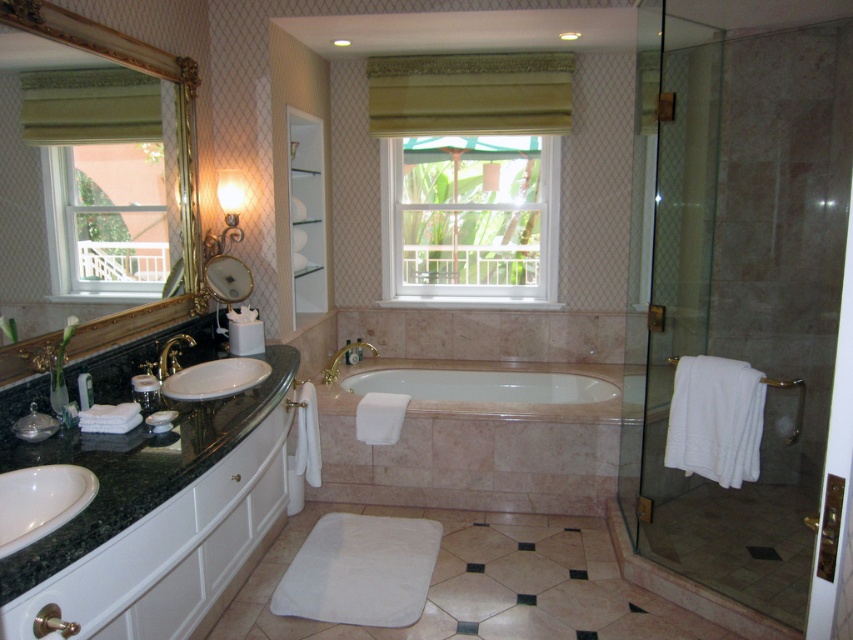
Question: Is transparent glass shower door at right bigger than white marble bathtub at center?

Choices:
 (A) no
 (B) yes

Answer: (B)

Question: Among these points, which one is farthest from the camera?

Choices:
 (A) (546, 172)
 (B) (218, 260)
 (C) (505, 378)

Answer: (A)

Question: Among these points, which one is nearest to the camera?

Choices:
 (A) pos(780,44)
 (B) pos(363,342)
 (C) pos(189,344)
 (D) pos(410,376)

Answer: (C)

Question: Is gold-framed mirror at upper left to the left of white glossy sink at left from the viewer's perspective?

Choices:
 (A) yes
 (B) no

Answer: (A)

Question: Among these points, which one is farthest from the camera?

Choices:
 (A) (190, 371)
 (B) (229, 253)

Answer: (B)

Question: Can you confirm if transparent glass shower door at right is positioned above white glossy sink at left?

Choices:
 (A) no
 (B) yes

Answer: (B)